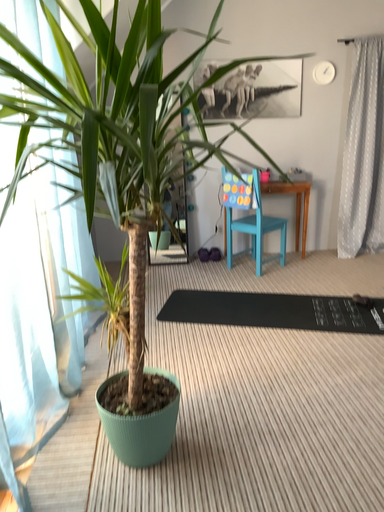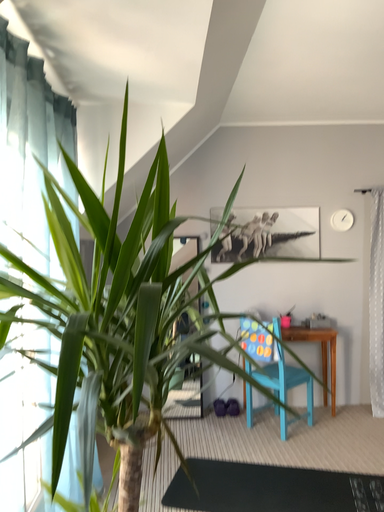
Question: Which way did the camera rotate in the video?

Choices:
 (A) rotated downward
 (B) rotated upward

Answer: (B)